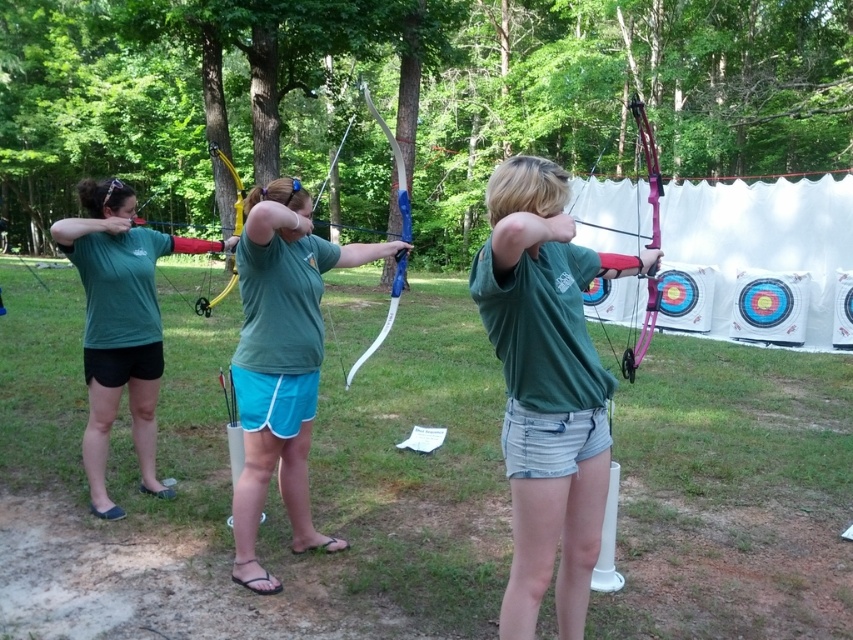
Consider the image. Is matte blue bow at center to the right of pink glossy bow at center from the viewer's perspective?

No, matte blue bow at center is not to the right of pink glossy bow at center.

Image resolution: width=853 pixels, height=640 pixels. Find the location of `matte blue bow at center`. matte blue bow at center is located at coordinates (281, 364).

Who is taller, green matte shirt at center or matte blue bow at center?

With more height is matte blue bow at center.

Is green matte shirt at center wider than matte blue bow at center?

No, green matte shirt at center is not wider than matte blue bow at center.

Is point (540, 397) in front of point (305, 452)?

Yes, it is.

Find the location of a particular element. This screenshot has width=853, height=640. green matte shirt at center is located at coordinates (546, 388).

Which is more to the right, green matte shirt at center or pink glossy bow at center?

pink glossy bow at center

Is green matte shirt at center to the left of pink glossy bow at center from the viewer's perspective?

Correct, you'll find green matte shirt at center to the left of pink glossy bow at center.

This screenshot has width=853, height=640. In order to click on green matte shirt at center in this screenshot , I will do `click(546, 388)`.

What are the coordinates of `green matte shirt at center` in the screenshot? It's located at (546, 388).